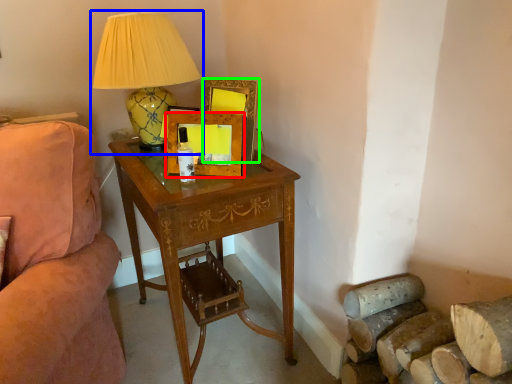
Question: Which is nearer to the picture frame (highlighted by a red box)? lamp (highlighted by a blue box) or picture frame (highlighted by a green box).

Choices:
 (A) lamp
 (B) picture frame

Answer: (B)